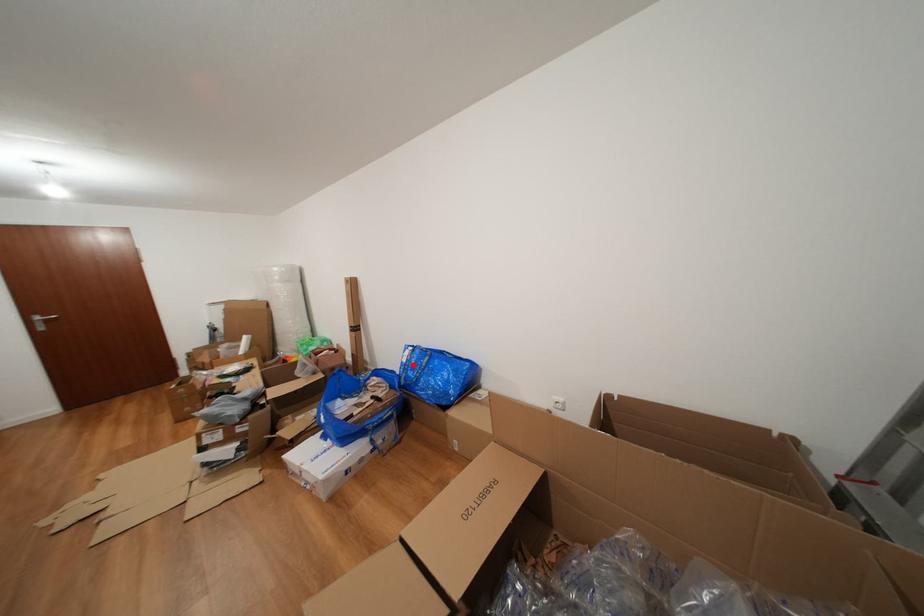
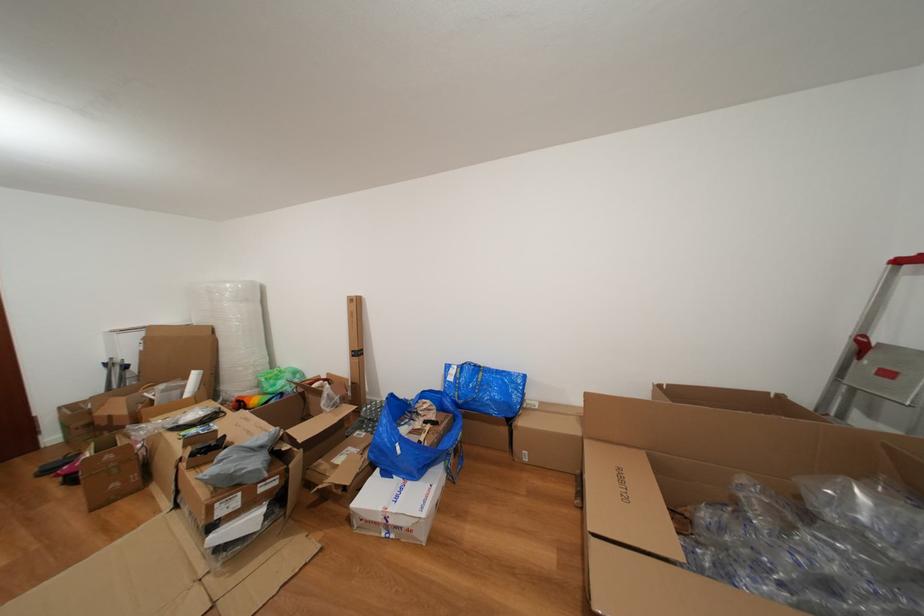
In the second image, find the point that corresponds to the highlighted location in the first image.

(458, 384)